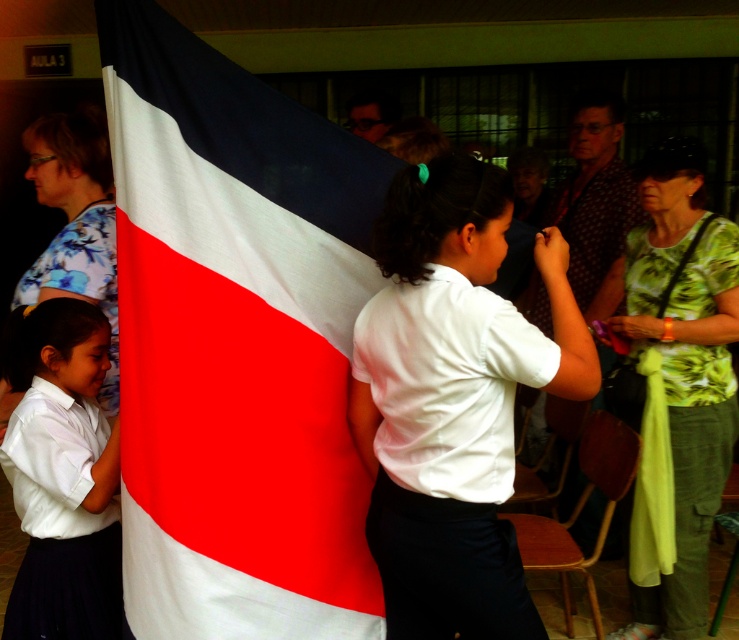
You are organizing a flag ceremony and need to ensure proper attire coordination. The two central participants are wearing a white smooth shirt at center and a white matte uniform at center. Which of these two items has a larger size?

The white smooth shirt at center has a larger size compared to the white matte uniform at center.

You are observing a flag ceremony from the back of the room. You notice two people in the crowd wearing distinctive shirts. The first is a green floral shirt at upper right, and the second is a patterned fabric shirt at center. Which of these two shirts is taller in the image?

The green floral shirt at upper right has a greater height compared to the patterned fabric shirt at center, so the green floral shirt at upper right is taller.

You are standing in front of the flag and want to move closer to the flag. Which point, point [355,429] or point [61,611], is closer to you?

Point [355,429] is further to the camera than point [61,611], so point [61,611] is closer to you.